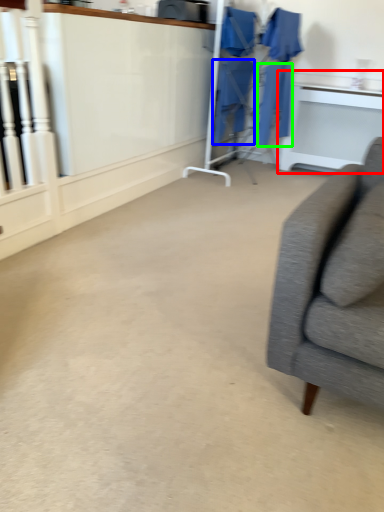
Question: Based on their relative distances, which object is nearer to table (highlighted by a red box)? Choose from robe (highlighted by a blue box) and robe (highlighted by a green box).

Choices:
 (A) robe
 (B) robe

Answer: (B)